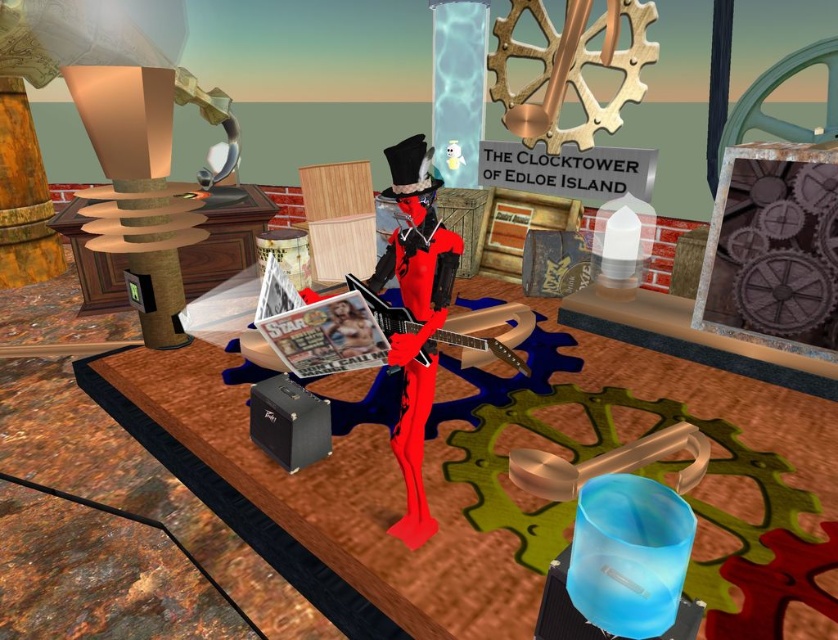
Question: Which point appears farthest from the camera in this image?

Choices:
 (A) (412, 456)
 (B) (763, 225)

Answer: (B)

Question: Is metallic gear at upper right smaller than shiny red figure at center?

Choices:
 (A) yes
 (B) no

Answer: (A)

Question: Is the position of metallic gear at upper right less distant than that of shiny red figure at center?

Choices:
 (A) yes
 (B) no

Answer: (B)

Question: Which point is farther to the camera?

Choices:
 (A) metallic gear at upper right
 (B) shiny red figure at center

Answer: (A)

Question: Among these points, which one is nearest to the camera?

Choices:
 (A) (773, 246)
 (B) (454, 266)

Answer: (B)

Question: Is metallic gear at upper right wider than shiny red figure at center?

Choices:
 (A) yes
 (B) no

Answer: (A)